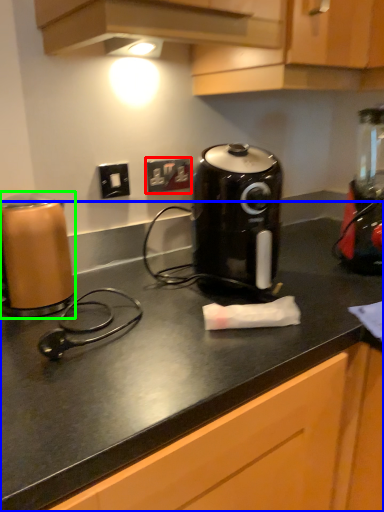
Question: Considering the real-world distances, which object is closest to electric outlet (highlighted by a red box)? counter (highlighted by a blue box) or home appliance (highlighted by a green box).

Choices:
 (A) counter
 (B) home appliance

Answer: (B)